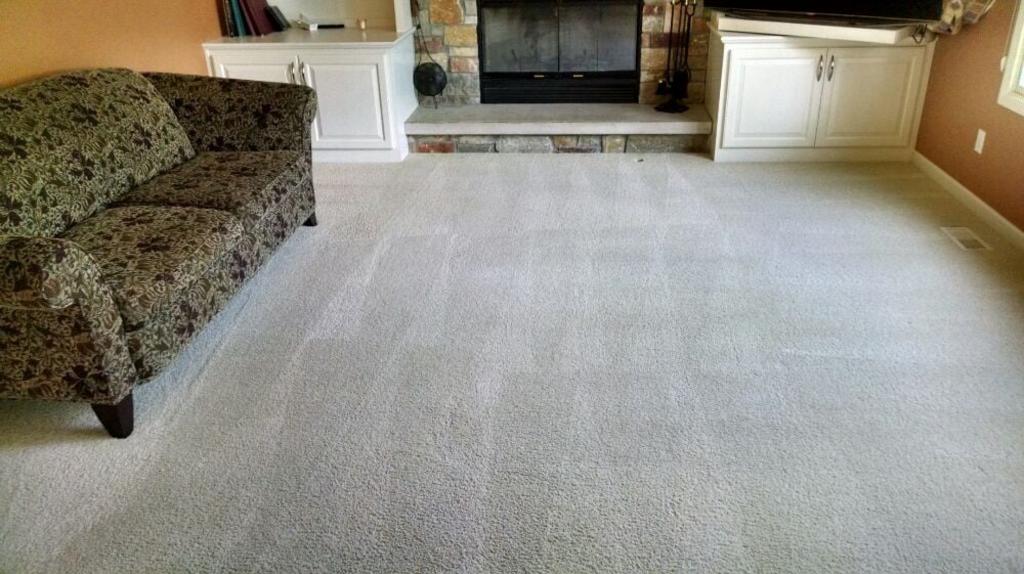
Where is `book`? The width and height of the screenshot is (1024, 574). book is located at coordinates (229, 19).